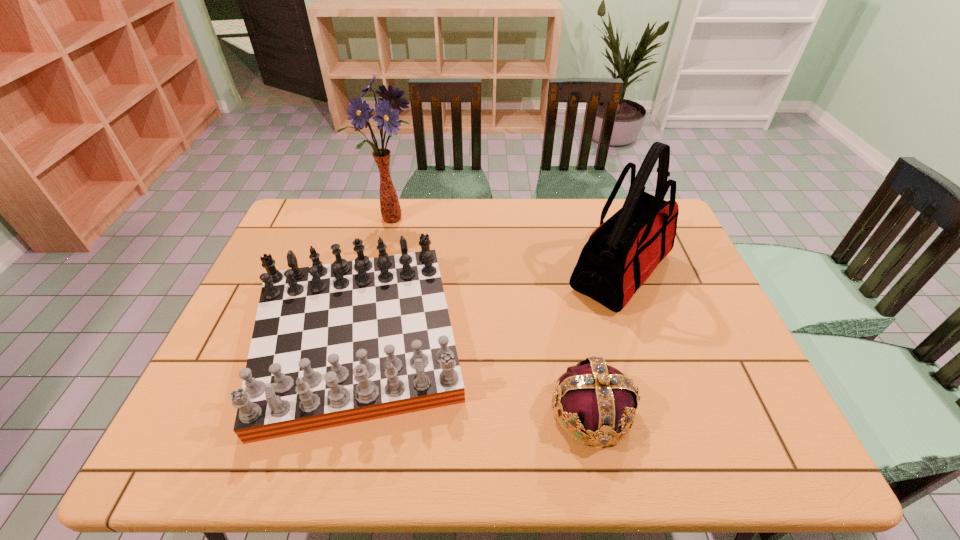
Where is `the farthest object`? the farthest object is located at coordinates (390, 208).

The image size is (960, 540). Identify the location of duffel bag. (619, 256).

Find the location of a particular element. This screenshot has width=960, height=540. gameboard is located at coordinates (334, 344).

In order to click on crown in this screenshot , I will do `click(595, 398)`.

Locate an element on the screen. The height and width of the screenshot is (540, 960). vacant space located on the left of the flower arrangement is located at coordinates (316, 219).

Identify the location of vacant area situated 0.320m on the front of the duffel bag. The height and width of the screenshot is (540, 960). (674, 429).

Locate an element on the screen. The width and height of the screenshot is (960, 540). vacant space located 0.340m on the back of the gameboard is located at coordinates (392, 201).

Where is `free region located 0.080m on the left of the crown`? The width and height of the screenshot is (960, 540). free region located 0.080m on the left of the crown is located at coordinates (514, 411).

This screenshot has height=540, width=960. Identify the location of flower arrangement that is at the far edge. (390, 208).

Identify the location of duffel bag that is at the far edge. This screenshot has height=540, width=960. click(x=619, y=256).